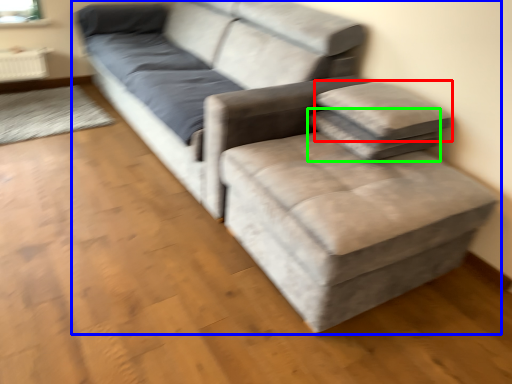
Question: Which is farther away from pillow (highlighted by a red box)? studio couch (highlighted by a blue box) or pillow (highlighted by a green box)?

Choices:
 (A) studio couch
 (B) pillow

Answer: (A)